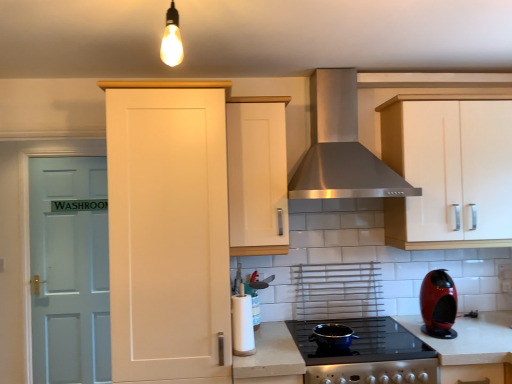
Locate an element on the screen. The width and height of the screenshot is (512, 384). black glass cooktop at center is located at coordinates (361, 342).

I want to click on white matte cabinet at upper right, marked as the 1th cabinetry in a right-to-left arrangement, so click(449, 169).

What do you see at coordinates (470, 338) in the screenshot? The width and height of the screenshot is (512, 384). I see `white glossy countertop at lower right` at bounding box center [470, 338].

The width and height of the screenshot is (512, 384). What do you see at coordinates (438, 304) in the screenshot? I see `shiny red coffee machine at right` at bounding box center [438, 304].

Locate an element on the screen. matte white cabinet at left, the first cabinetry when ordered from left to right is located at coordinates (168, 230).

Where is `black glass cooktop at center`? The height and width of the screenshot is (384, 512). black glass cooktop at center is located at coordinates (361, 342).

Is shiny red coffee machine at right facing away from white glossy countertop at lower right?

shiny red coffee machine at right is not turned away from white glossy countertop at lower right.

Based on the photo, considering the sizes of objects shiny red coffee machine at right and white glossy countertop at lower right in the image provided, who is taller, shiny red coffee machine at right or white glossy countertop at lower right?

white glossy countertop at lower right is taller.

Which of these two, shiny red coffee machine at right or white glossy countertop at lower right, is wider?

white glossy countertop at lower right is wider.

Considering the positions of objects matte black pot at center, the 2th appliance viewed from the left, and white paper towel holder at center, which ranks as the first appliance in left-to-right order, in the image provided, who is behind, matte black pot at center, the 2th appliance viewed from the left, or white paper towel holder at center, which ranks as the first appliance in left-to-right order,?

white paper towel holder at center, which ranks as the first appliance in left-to-right order.

Are matte black pot at center, the 2th appliance viewed from the left, and white paper towel holder at center, arranged as the second appliance when viewed from the right, located far from each other?

No, there isn't a large distance between matte black pot at center, the 2th appliance viewed from the left, and white paper towel holder at center, arranged as the second appliance when viewed from the right.

Which of these two, matte black pot at center, which is the first appliance in right-to-left order, or white paper towel holder at center, which ranks as the first appliance in left-to-right order, is wider?

matte black pot at center, which is the first appliance in right-to-left order.

From the image's perspective, is matte black pot at center, which is the first appliance in right-to-left order, above or below white paper towel holder at center, which ranks as the first appliance in left-to-right order?

Based on their image positions, matte black pot at center, which is the first appliance in right-to-left order, is located beneath white paper towel holder at center, which ranks as the first appliance in left-to-right order.

How much distance is there between black glass cooktop at center and matte black pot at center, the 2th appliance viewed from the left?

black glass cooktop at center and matte black pot at center, the 2th appliance viewed from the left, are 5.84 inches apart from each other.

Does black glass cooktop at center contain matte black pot at center, the 2th appliance viewed from the left?

No, matte black pot at center, the 2th appliance viewed from the left, is not surrounded by black glass cooktop at center.

From a real-world perspective, which is physically below, black glass cooktop at center or matte black pot at center, which is the first appliance in right-to-left order?

black glass cooktop at center is physically lower.

Are black glass cooktop at center and matte black pot at center, which is the first appliance in right-to-left order, making contact?

black glass cooktop at center and matte black pot at center, which is the first appliance in right-to-left order, are clearly separated.

From the picture: Is black glass cooktop at center closer to the viewer compared to white glossy countertop at lower right?

Answer: Yes, it is in front of white glossy countertop at lower right.

Between point (350, 350) and point (504, 328), which one is positioned in front?

The point (350, 350) is closer to the camera.

Looking at this image, can you confirm if black glass cooktop at center is shorter than white glossy countertop at lower right?

No.

Identify the location of counter top above the black glass cooktop at center (from the image's perspective). (470, 338).

From a real-world perspective, is shiny red coffee machine at right above or below matte white cabinet at left, the first cabinetry when ordered from left to right?

shiny red coffee machine at right is situated lower than matte white cabinet at left, the first cabinetry when ordered from left to right, in the real world.

Where is `the 1st cabinetry positioned above the shiny red coffee machine at right (from the image's perspective)`? The width and height of the screenshot is (512, 384). the 1st cabinetry positioned above the shiny red coffee machine at right (from the image's perspective) is located at coordinates (168, 230).

Considering the relative sizes of shiny red coffee machine at right and matte white cabinet at left, placed as the third cabinetry when sorted from right to left, in the image provided, is shiny red coffee machine at right thinner than matte white cabinet at left, placed as the third cabinetry when sorted from right to left,?

Indeed, shiny red coffee machine at right has a lesser width compared to matte white cabinet at left, placed as the third cabinetry when sorted from right to left.

Locate an element on the screen. This screenshot has height=384, width=512. home appliance to the right of matte black pot at center, the 2th appliance viewed from the left is located at coordinates [x=341, y=147].

Which is correct: stainless steel range hood at center is inside matte black pot at center, which is the first appliance in right-to-left order, or outside of it?

stainless steel range hood at center is not enclosed by matte black pot at center, which is the first appliance in right-to-left order.

Measure the distance between stainless steel range hood at center and matte black pot at center, which is the first appliance in right-to-left order.

They are 34.31 inches apart.

Is point (330, 183) less distant than point (347, 328)?

Yes, it is.

From a real-world perspective, does matte white cabinet at left, placed as the third cabinetry when sorted from right to left, stand above white glossy countertop at lower right?

Yes, from a real-world perspective, matte white cabinet at left, placed as the third cabinetry when sorted from right to left, is over white glossy countertop at lower right

You are a GUI agent. You are given a task and a screenshot of the screen. Output one action in this format:
    pyautogui.click(x=<x>, y=<y>)
    Task: Click on the cabinetry that is the 1st one above the white glossy countertop at lower right (from a real-world perspective)
    The width and height of the screenshot is (512, 384).
    Given the screenshot: What is the action you would take?
    pyautogui.click(x=168, y=230)

Are matte white cabinet at left, placed as the third cabinetry when sorted from right to left, and white glossy countertop at lower right far apart?

Yes.

Considering the sizes of matte white cabinet at left, the first cabinetry when ordered from left to right, and white glossy countertop at lower right in the image, is matte white cabinet at left, the first cabinetry when ordered from left to right, taller or shorter than white glossy countertop at lower right?

Considering their sizes, matte white cabinet at left, the first cabinetry when ordered from left to right, has more height than white glossy countertop at lower right.

The width and height of the screenshot is (512, 384). I want to click on counter top that is on the right side of shiny red coffee machine at right, so click(470, 338).

Where is `appliance lying behind the matte black pot at center, which is the first appliance in right-to-left order`? This screenshot has height=384, width=512. appliance lying behind the matte black pot at center, which is the first appliance in right-to-left order is located at coordinates pyautogui.click(x=242, y=324).

Estimate the real-world distances between objects in this image. Which object is further from matte white cabinet at center, the 2th cabinetry when ordered from left to right, white matte cabinet at upper right, marked as the 1th cabinetry in a right-to-left arrangement, or light blue wood door at left?

light blue wood door at left is positioned further to the anchor matte white cabinet at center, the 2th cabinetry when ordered from left to right.

When comparing their distances from white paper towel holder at center, arranged as the second appliance when viewed from the right, does white glossy countertop at lower right or light blue wood door at left seem further?

light blue wood door at left is further to white paper towel holder at center, arranged as the second appliance when viewed from the right.

Looking at the image, which one is located closer to matte white cabinet at left, the first cabinetry when ordered from left to right, black glass cooktop at center or shiny red coffee machine at right?

black glass cooktop at center is positioned closer to the anchor matte white cabinet at left, the first cabinetry when ordered from left to right.

Looking at the image, which one is located closer to black glass cooktop at center, matte white cabinet at center, which is counted as the 2th cabinetry, starting from the right, or white glossy countertop at lower right?

white glossy countertop at lower right is positioned closer to the anchor black glass cooktop at center.

Consider the image. From the image, which object appears to be nearer to matte black pot at center, the 2th appliance viewed from the left, white glossy countertop at lower right or matte white cabinet at left, placed as the third cabinetry when sorted from right to left?

white glossy countertop at lower right is closer to matte black pot at center, the 2th appliance viewed from the left.

Looking at the image, which one is located closer to black glass cooktop at center, matte white cabinet at center, the 2th cabinetry when ordered from left to right, or white paper towel holder at center, which ranks as the first appliance in left-to-right order?

white paper towel holder at center, which ranks as the first appliance in left-to-right order, is closer to black glass cooktop at center.

Based on their spatial positions, is black glass cooktop at center or white glossy countertop at lower right closer to matte white cabinet at center, the 2th cabinetry when ordered from left to right?

black glass cooktop at center.

From the image, which object appears to be farther from white matte cabinet at upper right, which is the 3th cabinetry in left-to-right order, white glossy countertop at lower right or matte white cabinet at left, placed as the third cabinetry when sorted from right to left?

matte white cabinet at left, placed as the third cabinetry when sorted from right to left, lies further to white matte cabinet at upper right, which is the 3th cabinetry in left-to-right order, than the other object.

The image size is (512, 384). Find the location of `appliance located between matte white cabinet at center, the 2th cabinetry when ordered from left to right, and shiny red coffee machine at right in the left-right direction`. appliance located between matte white cabinet at center, the 2th cabinetry when ordered from left to right, and shiny red coffee machine at right in the left-right direction is located at coordinates (332, 336).

Locate an element on the screen. home appliance between light blue wood door at left and white matte cabinet at upper right, which is the 3th cabinetry in left-to-right order, in the horizontal direction is located at coordinates (341, 147).

Locate an element on the screen. counter top between light blue wood door at left and white matte cabinet at upper right, which is the 3th cabinetry in left-to-right order, from left to right is located at coordinates (470, 338).

Identify the location of kitchen appliance situated between matte white cabinet at center, which is counted as the 2th cabinetry, starting from the right, and white matte cabinet at upper right, which is the 3th cabinetry in left-to-right order, from left to right. This screenshot has height=384, width=512. (438, 304).